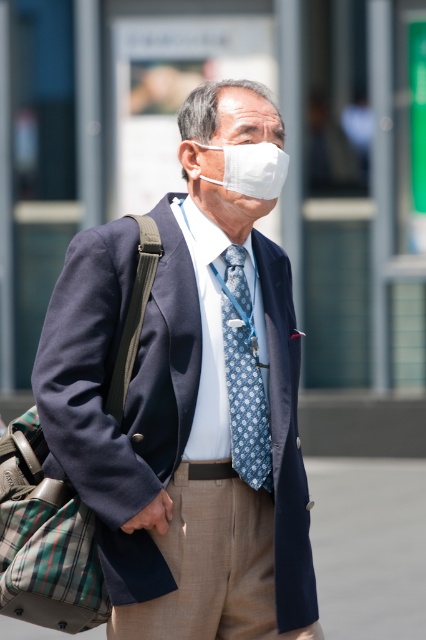
Question: Does blue dotted tie at center have a larger size compared to white matte mask at center?

Choices:
 (A) yes
 (B) no

Answer: (A)

Question: Is plaid fabric bag at left to the right of white matte mask at center from the viewer's perspective?

Choices:
 (A) no
 (B) yes

Answer: (A)

Question: Which is farther from the white matte mask at center?

Choices:
 (A) navy wool suit at center
 (B) plaid fabric bag at left

Answer: (B)

Question: Which point is farther from the camera taking this photo?

Choices:
 (A) (267, 168)
 (B) (69, 413)

Answer: (A)

Question: Which point is closer to the camera?

Choices:
 (A) (213, 272)
 (B) (123, 573)

Answer: (B)

Question: From the image, what is the correct spatial relationship of blue dotted tie at center in relation to white matte mask at center?

Choices:
 (A) below
 (B) above

Answer: (A)